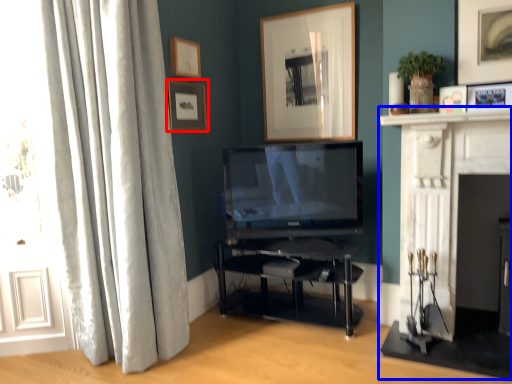
Question: Which point is closer to the camera, picture frame (highlighted by a red box) or fireplace (highlighted by a blue box)?

Choices:
 (A) picture frame
 (B) fireplace

Answer: (B)